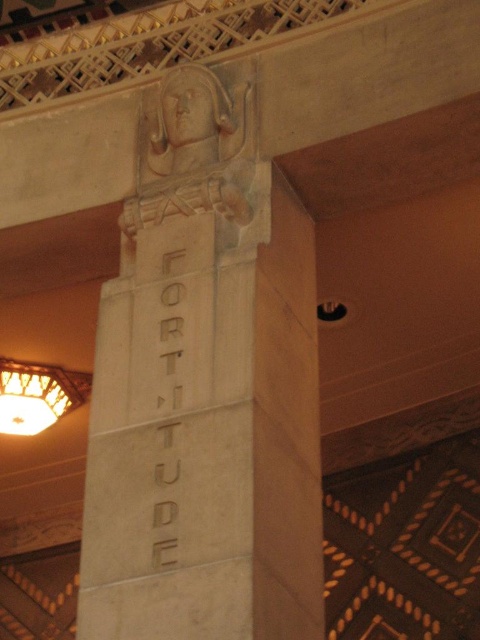
You are an interior designer assessing the proportions of the room. Given the white stone relief at center and the matte brass lampshade at left, which object has a greater height? Please base your answer on the spatial relationships described in the scene.

The matte brass lampshade at left is taller than the white stone relief at center, as the white stone relief at center is shorter than matte brass lampshade at left.

Looking at this image, you are standing in the grand hall and need to place a new decorative item between the white stone relief at center and the matte brass lampshade at left. Based on their positions, which object should the new item be closer to?

The white stone relief at center is to the right of the matte brass lampshade at left, so the new decorative item should be placed closer to the matte brass lampshade at left to maintain symmetry between the two objects.

You are standing in the grand hall and want to know how far you are from the point marked at coordinates (x=153, y=208). Can you determine the distance?

The point marked at coordinates (x=153, y=208) is 27.97 meters away from you.